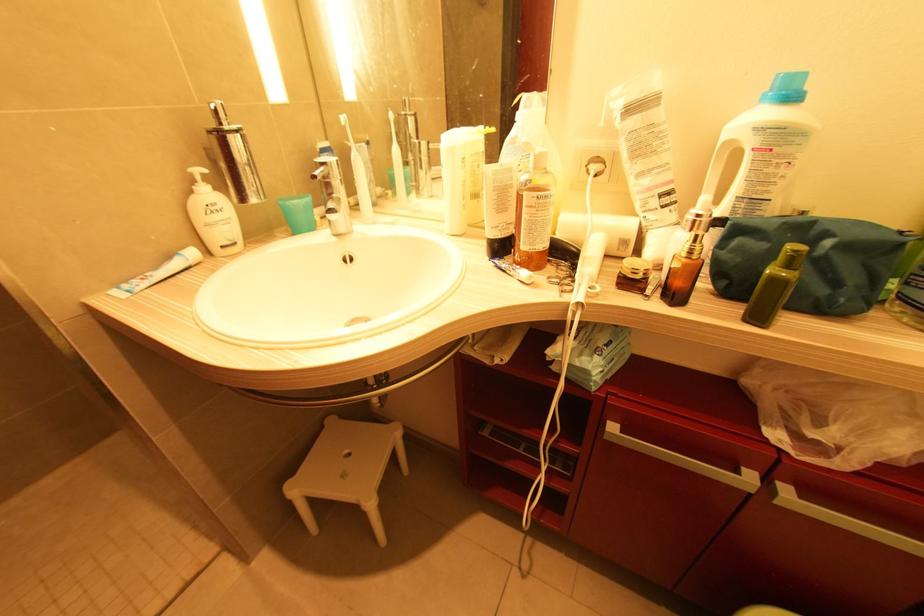
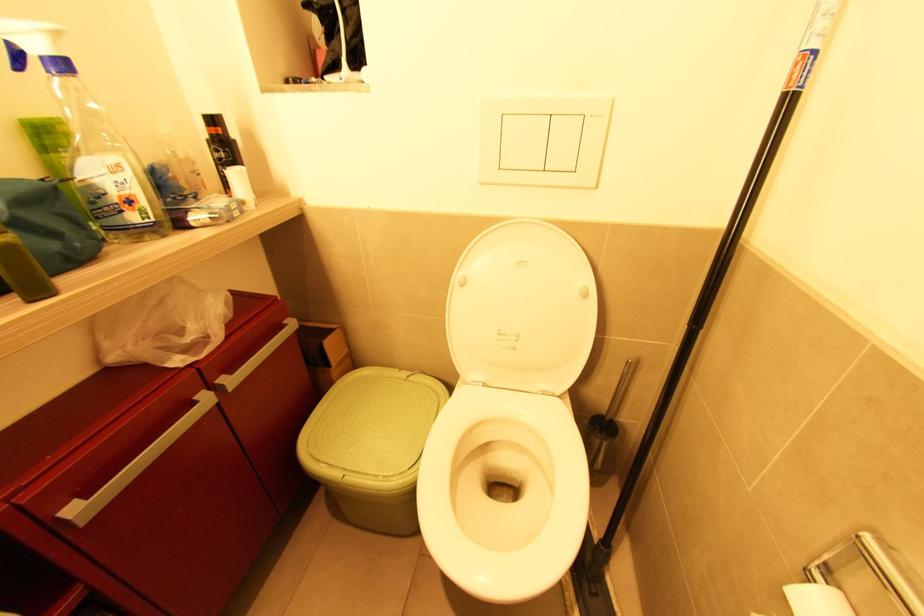
In the scene shown: The first image is from the beginning of the video and the second image is from the end. How did the camera likely rotate when shooting the video?

The rotation direction of the camera is right-down.